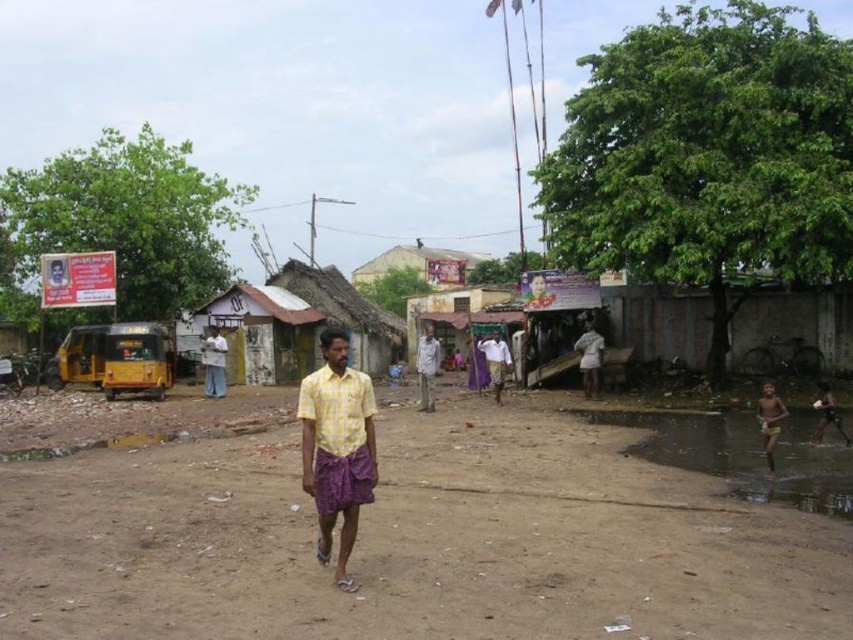
Can you confirm if yellow skin at lower right is wider than white cotton shirt at center?

Yes.

Between point (763, 400) and point (497, 348), which one is positioned in front?

Positioned in front is point (763, 400).

Locate an element on the screen. yellow skin at lower right is located at coordinates (769, 420).

Which is behind, point (412, 262) or point (778, 400)?

Point (412, 262)

Who is higher up, white corrugated metal hut at center or yellow skin at lower right?

white corrugated metal hut at center is above.

You are a GUI agent. You are given a task and a screenshot of the screen. Output one action in this format:
    pyautogui.click(x=<x>, y=<y>)
    Task: Click on the white corrugated metal hut at center
    This screenshot has width=853, height=640.
    Given the screenshot: What is the action you would take?
    pyautogui.click(x=421, y=264)

Who is positioned more to the right, yellowish sand at lower right or yellow skin at lower right?

yellow skin at lower right

Is point (688, 440) behind point (764, 435)?

Yes, point (688, 440) is farther from viewer.

You are a GUI agent. You are given a task and a screenshot of the screen. Output one action in this format:
    pyautogui.click(x=<x>, y=<y>)
    Task: Click on the yellowish sand at lower right
    This screenshot has height=640, width=853.
    Given the screenshot: What is the action you would take?
    pyautogui.click(x=743, y=456)